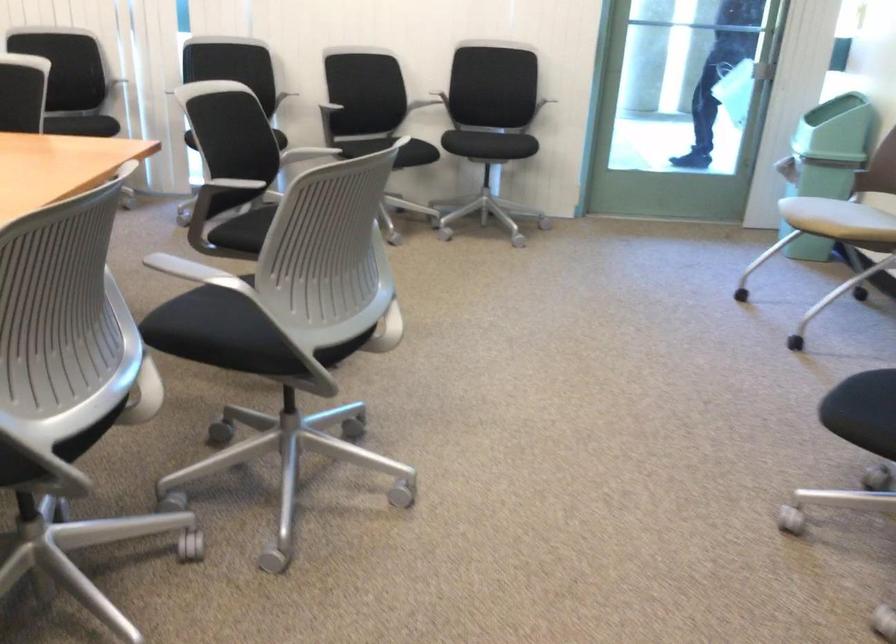
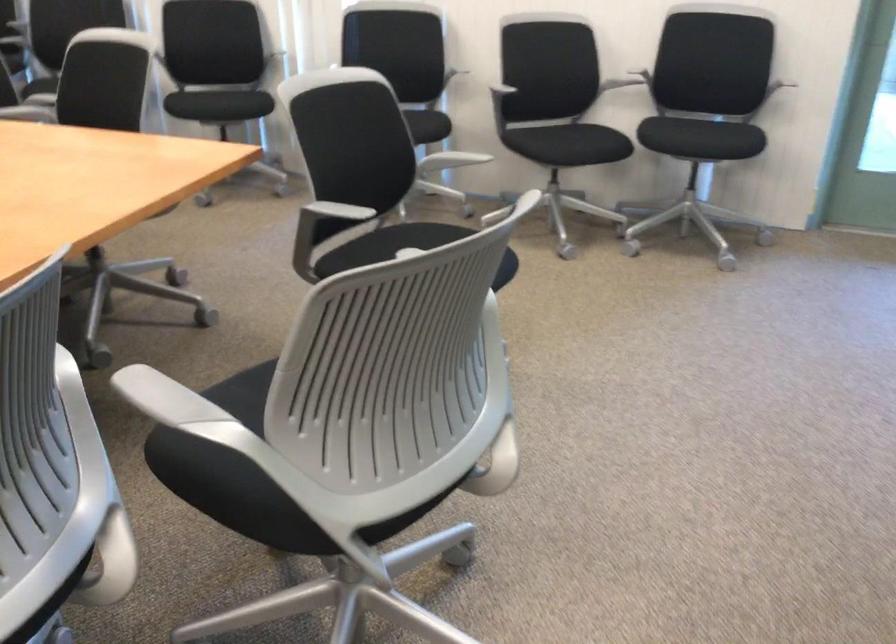
The point at (96, 118) is marked in the first image. Where is the corresponding point in the second image?

(238, 102)